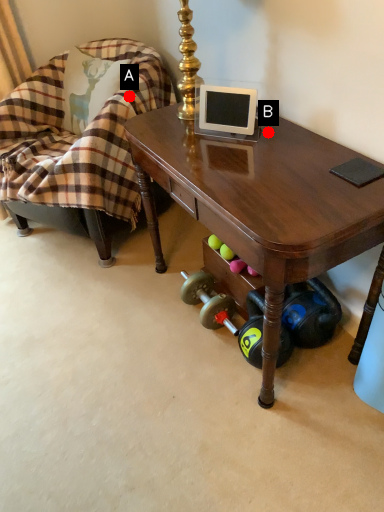
Question: Two points are circled on the image, labeled by A and B beside each circle. Which point is closer to the camera taking this photo?

Choices:
 (A) A is closer
 (B) B is closer

Answer: (B)